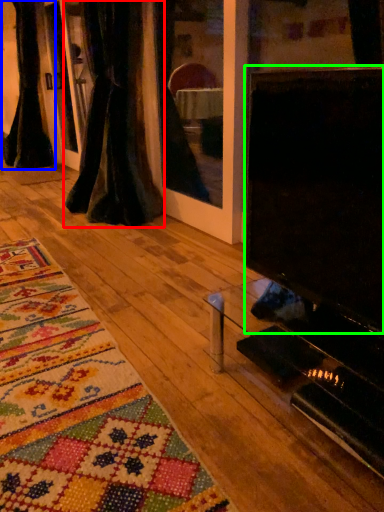
Question: Which object is the closest to the curtain (highlighted by a red box)? Choose among these: curtain (highlighted by a blue box) or screen (highlighted by a green box).

Choices:
 (A) curtain
 (B) screen

Answer: (A)